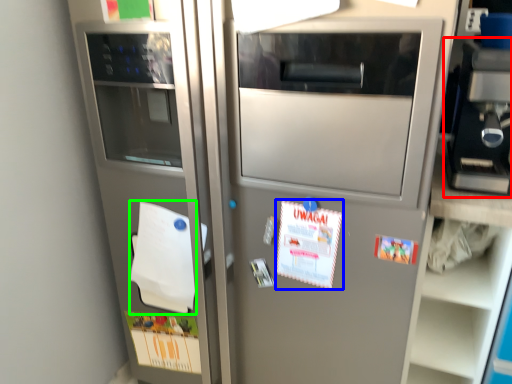
Question: Estimate the real-world distances between objects in this image. Which object is closer to appliance (highlighted by a red box), postcard (highlighted by a blue box) or notepad (highlighted by a green box)?

Choices:
 (A) postcard
 (B) notepad

Answer: (A)